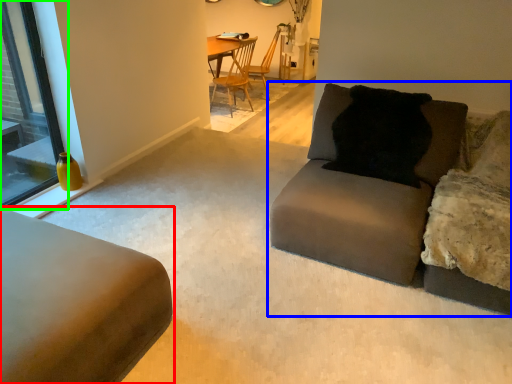
Question: Based on their relative distances, which object is nearer to studio couch (highlighted by a red box)? Choose from studio couch (highlighted by a blue box) and window (highlighted by a green box).

Choices:
 (A) studio couch
 (B) window

Answer: (A)